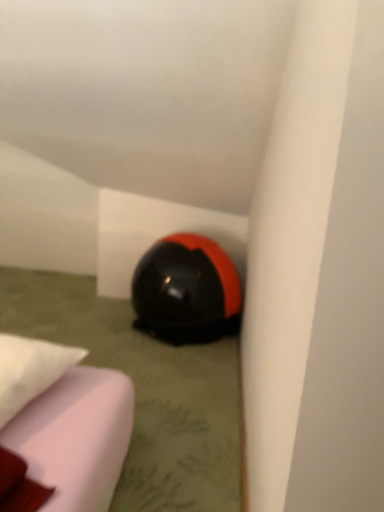
Question: From a real-world perspective, is white fabric pillow at lower left located higher than black glossy helmet at lower center?

Choices:
 (A) yes
 (B) no

Answer: (A)

Question: From the image's perspective, is white fabric pillow at lower left under black glossy helmet at lower center?

Choices:
 (A) no
 (B) yes

Answer: (B)

Question: Is white fabric pillow at lower left to the left of black glossy helmet at lower center from the viewer's perspective?

Choices:
 (A) yes
 (B) no

Answer: (A)

Question: Is the position of white fabric pillow at lower left more distant than that of black glossy helmet at lower center?

Choices:
 (A) no
 (B) yes

Answer: (A)

Question: Can you confirm if white fabric pillow at lower left is smaller than black glossy helmet at lower center?

Choices:
 (A) yes
 (B) no

Answer: (A)

Question: Is white fabric pillow at lower left to the right of black glossy helmet at lower center from the viewer's perspective?

Choices:
 (A) no
 (B) yes

Answer: (A)

Question: Can you confirm if black glossy helmet at lower center is shorter than white fabric pillow at lower left?

Choices:
 (A) no
 (B) yes

Answer: (A)

Question: From the image's perspective, is black glossy helmet at lower center located beneath white fabric pillow at lower left?

Choices:
 (A) no
 (B) yes

Answer: (A)

Question: Would you consider black glossy helmet at lower center to be distant from white fabric pillow at lower left?

Choices:
 (A) yes
 (B) no

Answer: (B)

Question: Considering the relative positions of black glossy helmet at lower center and white fabric pillow at lower left in the image provided, is black glossy helmet at lower center to the left of white fabric pillow at lower left from the viewer's perspective?

Choices:
 (A) yes
 (B) no

Answer: (B)

Question: Is black glossy helmet at lower center bigger than white fabric pillow at lower left?

Choices:
 (A) no
 (B) yes

Answer: (B)

Question: From a real-world perspective, is black glossy helmet at lower center on white fabric pillow at lower left?

Choices:
 (A) no
 (B) yes

Answer: (A)

Question: Considering the relative positions of white fabric pillow at lower left and black glossy helmet at lower center in the image provided, is white fabric pillow at lower left to the left or to the right of black glossy helmet at lower center?

Choices:
 (A) right
 (B) left

Answer: (B)